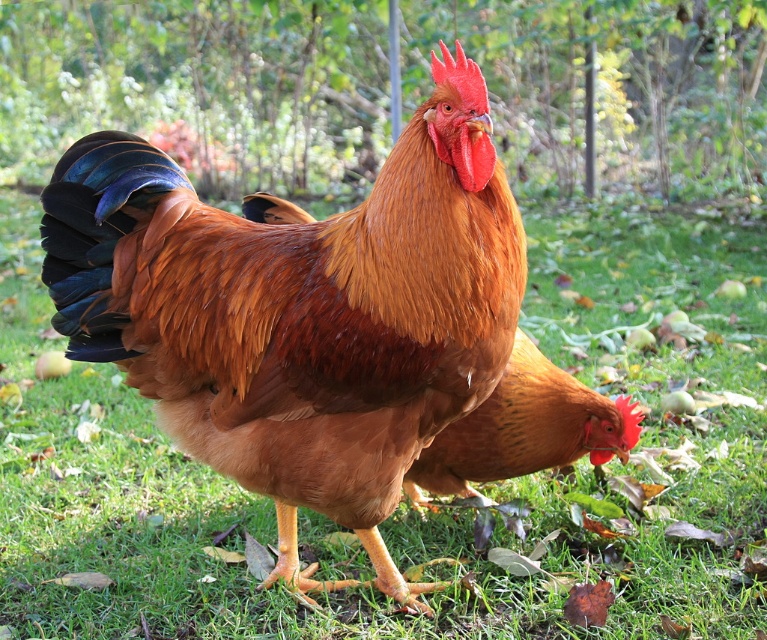
Question: Can you confirm if shiny brown rooster at center is bigger than brown feathered chicken at center?

Choices:
 (A) yes
 (B) no

Answer: (A)

Question: Does shiny brown rooster at center have a lesser width compared to brown feathered chicken at center?

Choices:
 (A) no
 (B) yes

Answer: (A)

Question: Can you confirm if shiny brown rooster at center is positioned below brown feathered chicken at center?

Choices:
 (A) no
 (B) yes

Answer: (A)